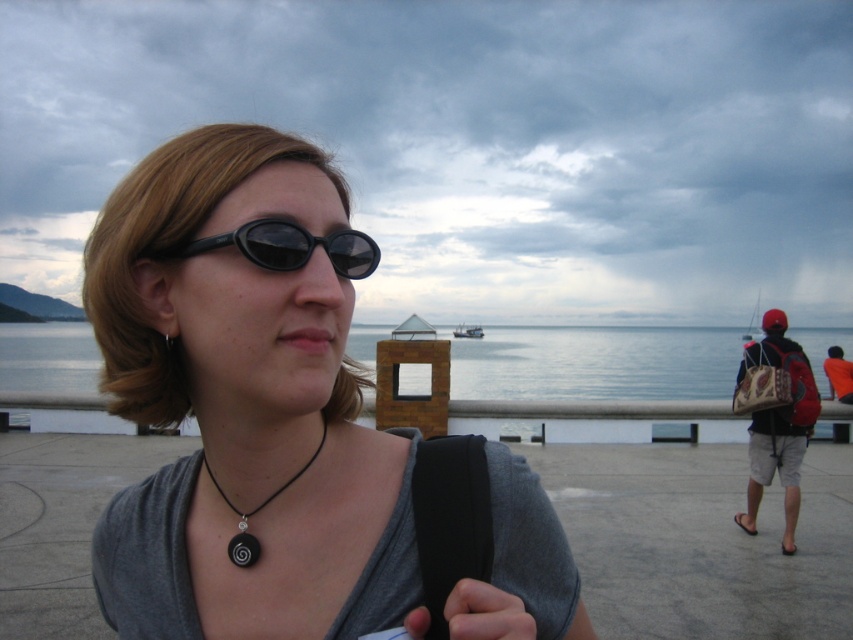
Based on the photo, how distant is transparent water at center from black matte sunglasses at center?

transparent water at center is 66.52 feet away from black matte sunglasses at center.

Is transparent water at center bigger than black matte sunglasses at center?

Indeed, transparent water at center has a larger size compared to black matte sunglasses at center.

Which is in front, point (511, 356) or point (294, 244)?

Point (294, 244) is more forward.

You are a GUI agent. You are given a task and a screenshot of the screen. Output one action in this format:
    pyautogui.click(x=<x>, y=<y>)
    Task: Click on the transparent water at center
    The height and width of the screenshot is (640, 853).
    Given the screenshot: What is the action you would take?
    pyautogui.click(x=595, y=364)

Is matte gray shirt at center shorter than transparent water at center?

Yes.

Does point (242, 200) come behind point (7, 337)?

No, it is in front of (7, 337).

At what (x,y) coordinates should I click in order to perform the action: click on matte gray shirt at center. Please return your answer as a coordinate pair (x, y). This screenshot has width=853, height=640. Looking at the image, I should click on (245, 401).

Does point (750, 493) come in front of point (312, 460)?

That is False.

Which of these two, leather backpack at right or black matte pendant at center, stands shorter?

Standing shorter between the two is black matte pendant at center.

The width and height of the screenshot is (853, 640). What do you see at coordinates (778, 424) in the screenshot?
I see `leather backpack at right` at bounding box center [778, 424].

This screenshot has height=640, width=853. In order to click on leather backpack at right in this screenshot , I will do `click(778, 424)`.